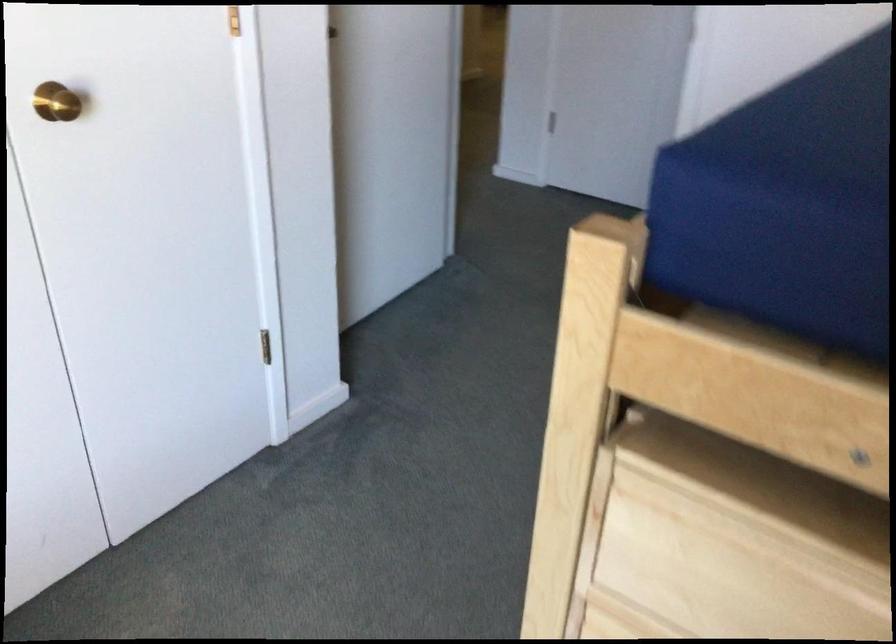
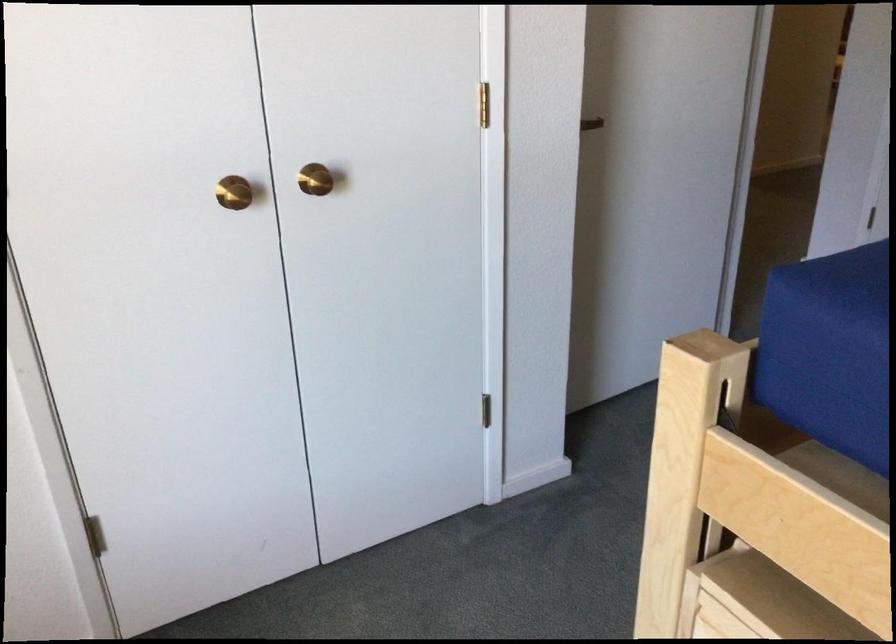
Question: Which direction would the cameraman need to move to produce the second image? Reply with the corresponding letter.

Choices:
 (A) Left
 (B) Right
 (C) Forward
 (D) Backward

Answer: (B)